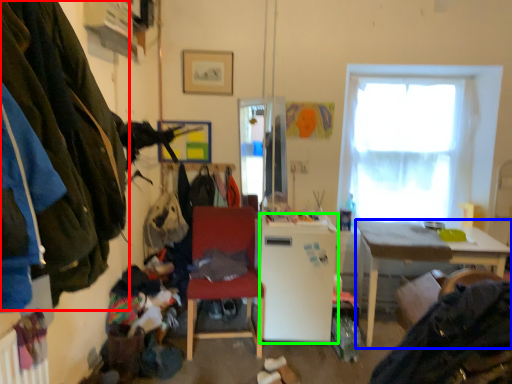
Question: Which is farther away from clothing (highlighted by a red box)? desk (highlighted by a blue box) or refrigerator (highlighted by a green box)?

Choices:
 (A) desk
 (B) refrigerator

Answer: (A)